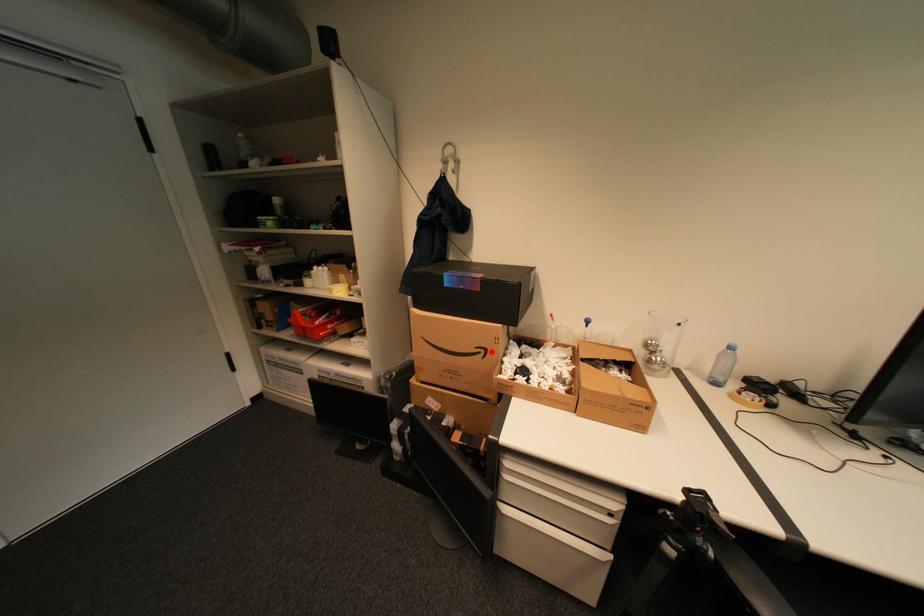
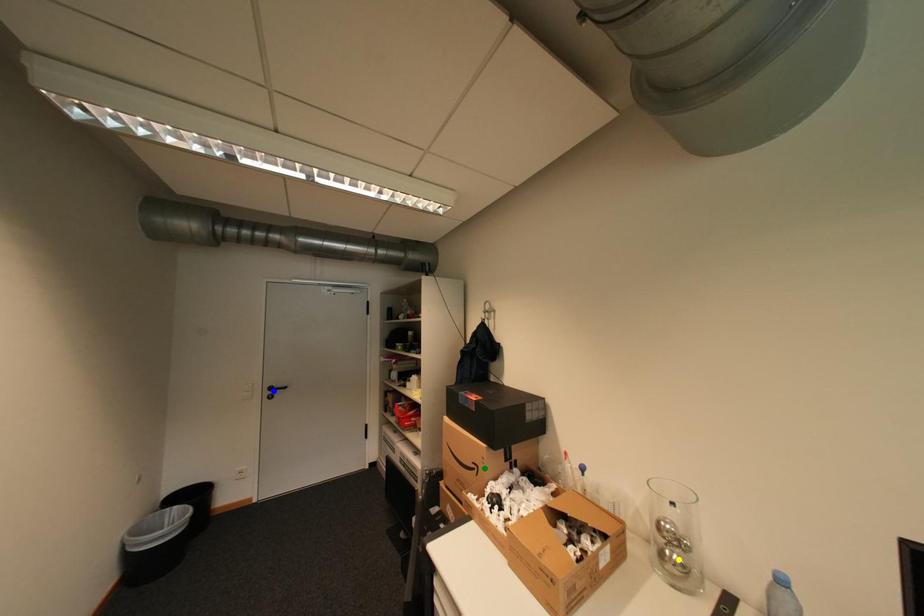
Question: I am providing you with two images of the same scene from different viewpoints. A red point is marked on the first image. You are given multiple points on the second image. Which spot in image 2 lines up with the point in image 1?

Choices:
 (A) green point
 (B) yellow point
 (C) blue point

Answer: (A)